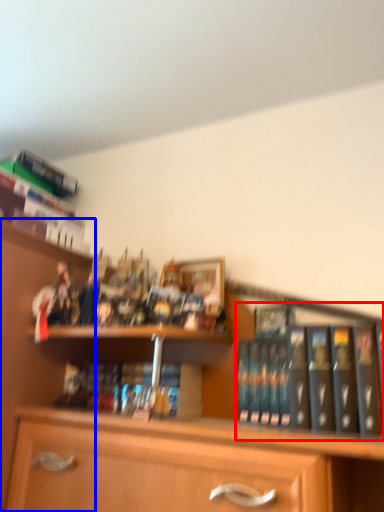
Question: Which of the following is the closest to the observer, book (highlighted by a red box) or shelf (highlighted by a blue box)?

Choices:
 (A) book
 (B) shelf

Answer: (B)